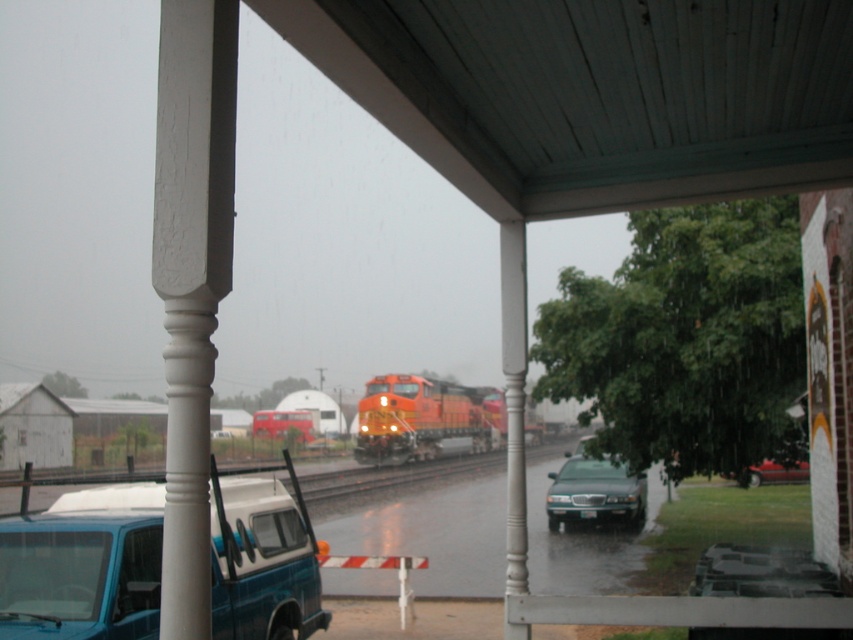
Is teal matte van at lower left shorter than glossy asphalt flood at lower center?

Correct, teal matte van at lower left is not as tall as glossy asphalt flood at lower center.

You are a GUI agent. You are given a task and a screenshot of the screen. Output one action in this format:
    pyautogui.click(x=<x>, y=<y>)
    Task: Click on the teal matte van at lower left
    
    Given the screenshot: What is the action you would take?
    pyautogui.click(x=84, y=566)

Which of these two, green matte sedan at center or metallic red car at lower right, stands shorter?

With less height is green matte sedan at center.

You are a GUI agent. You are given a task and a screenshot of the screen. Output one action in this format:
    pyautogui.click(x=<x>, y=<y>)
    Task: Click on the green matte sedan at center
    
    Given the screenshot: What is the action you would take?
    pyautogui.click(x=595, y=493)

This screenshot has width=853, height=640. What are the coordinates of `green matte sedan at center` in the screenshot? It's located at (595, 493).

Who is positioned more to the right, teal matte van at lower left or green matte sedan at center?

green matte sedan at center is more to the right.

Is teal matte van at lower left to the right of green matte sedan at center from the viewer's perspective?

In fact, teal matte van at lower left is to the left of green matte sedan at center.

Describe the element at coordinates (84, 566) in the screenshot. This screenshot has height=640, width=853. I see `teal matte van at lower left` at that location.

Locate an element on the screen. The image size is (853, 640). teal matte van at lower left is located at coordinates (84, 566).